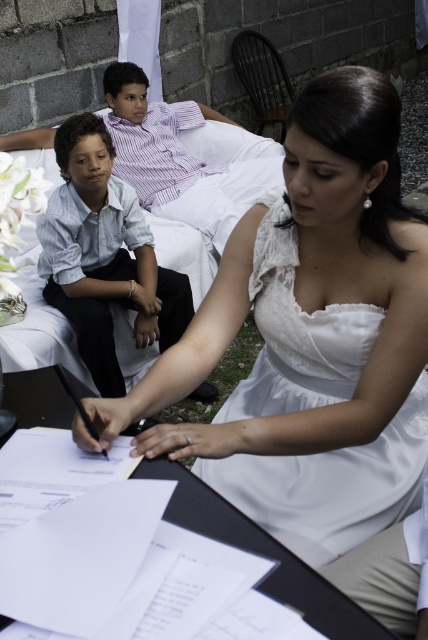
Question: Considering the relative positions of white satin dress at center and white paper at center in the image provided, where is white satin dress at center located with respect to white paper at center?

Choices:
 (A) right
 (B) left

Answer: (A)

Question: Observing the image, what is the correct spatial positioning of white satin dress at center in reference to striped cotton shirt at left?

Choices:
 (A) right
 (B) left

Answer: (A)

Question: Which point is closer to the camera taking this photo?

Choices:
 (A) (92, 561)
 (B) (407, 410)
 (C) (107, 176)

Answer: (A)

Question: Is white paper at center above striped cotton shirt at left?

Choices:
 (A) yes
 (B) no

Answer: (B)

Question: Which object is closer to the camera taking this photo?

Choices:
 (A) white paper at center
 (B) white satin dress at center

Answer: (A)

Question: Which of these objects is positioned farthest from the white satin dress at center?

Choices:
 (A) white paper at center
 (B) striped cotton shirt at left

Answer: (B)